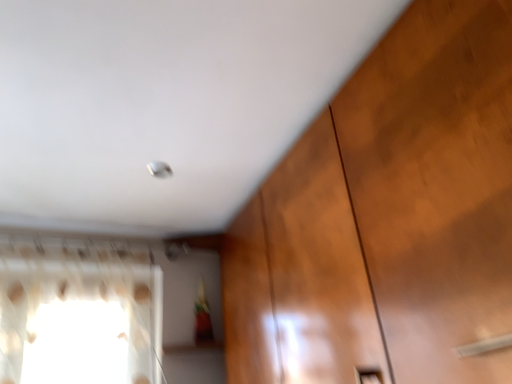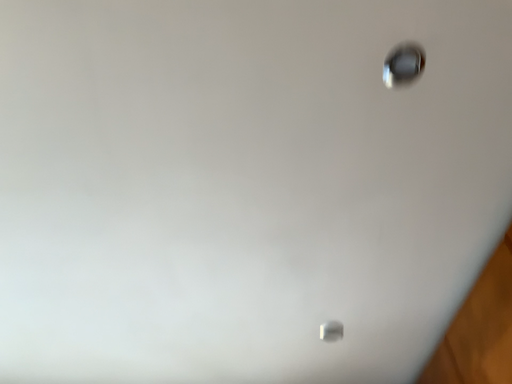
Question: Which way did the camera rotate in the video?

Choices:
 (A) rotated downward
 (B) rotated upward

Answer: (B)